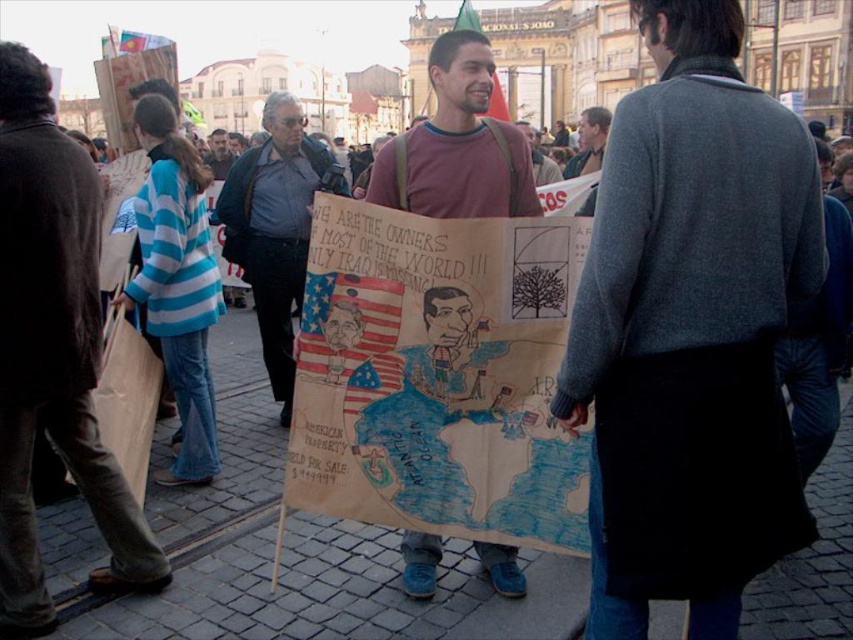
Does matte brown paper sign at center appear on the right side of matte brown poster at center?

In fact, matte brown paper sign at center is to the left of matte brown poster at center.

At what (x,y) coordinates should I click in order to perform the action: click on matte brown paper sign at center. Please return your answer as a coordinate pair (x, y). Image resolution: width=853 pixels, height=640 pixels. Looking at the image, I should click on [x=51, y=349].

Find the location of a particular element. The height and width of the screenshot is (640, 853). matte brown paper sign at center is located at coordinates (51, 349).

Can you confirm if gray wool sweater at center is smaller than matte black jacket at center?

Yes.

Where is `gray wool sweater at center`? gray wool sweater at center is located at coordinates (691, 330).

The height and width of the screenshot is (640, 853). In order to click on gray wool sweater at center in this screenshot , I will do `click(691, 330)`.

Is matte brown paper sign at center further to the viewer compared to matte brown jacket at center?

That is False.

Between point (15, 451) and point (556, 168), which one is positioned behind?

The point (556, 168) is behind.

Identify the location of matte brown paper sign at center. (51, 349).